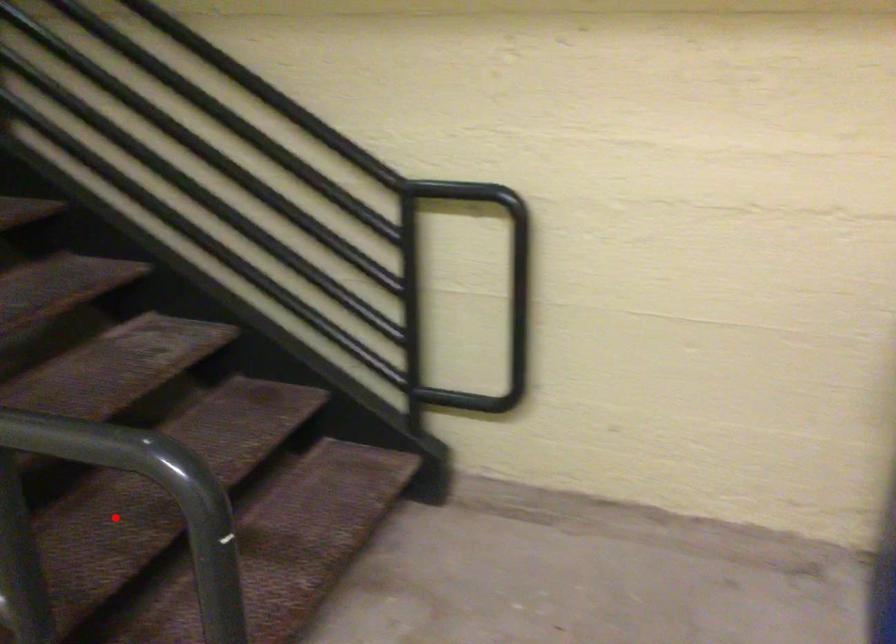
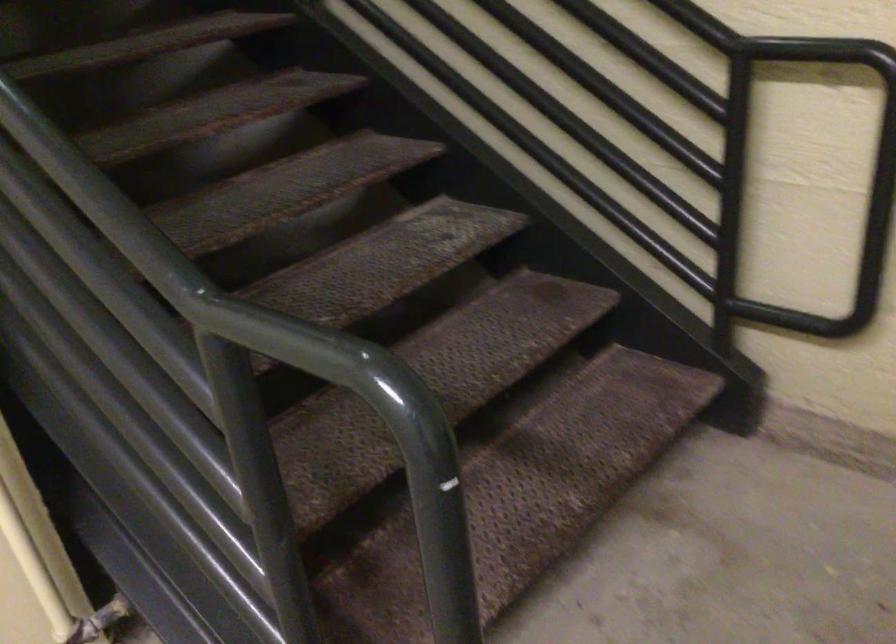
Question: I am providing you with two images of the same scene from different viewpoints. A red point is marked on the first image. Is the red point's position out of view in image 2?

Choices:
 (A) Yes
 (B) No

Answer: (A)